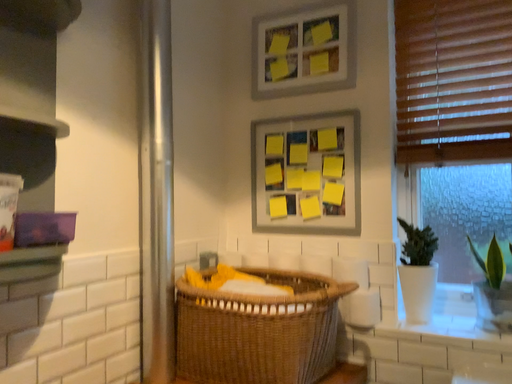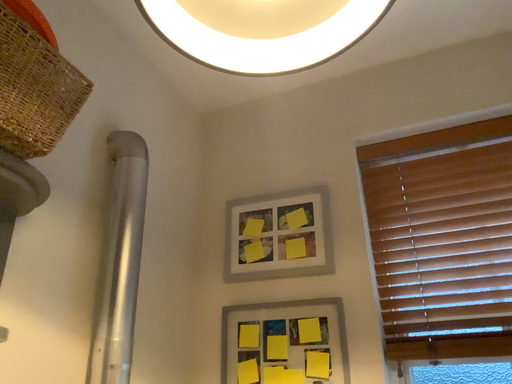
Question: Which way did the camera rotate in the video?

Choices:
 (A) rotated upward
 (B) rotated downward

Answer: (A)